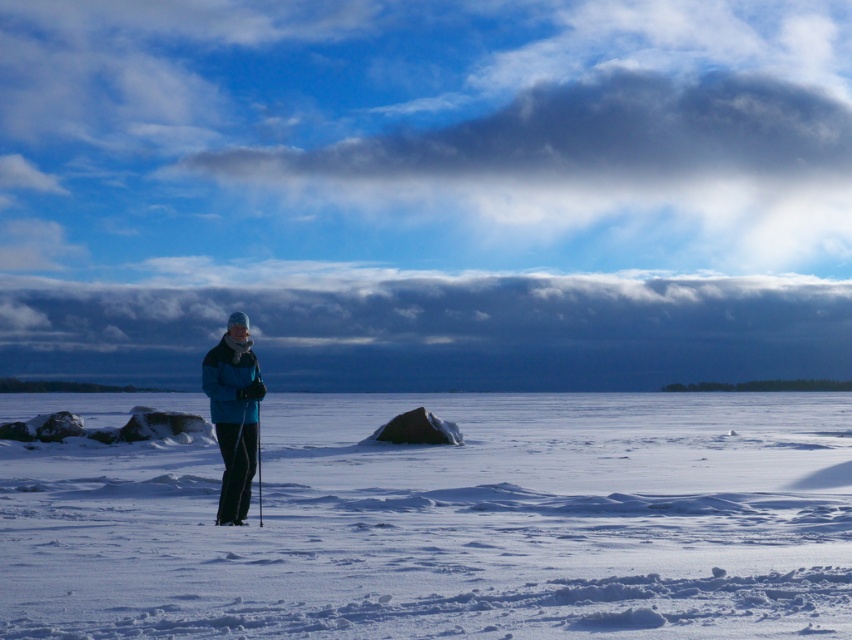
Question: Does white powdery snow at center have a smaller size compared to blue fleece jacket at center?

Choices:
 (A) yes
 (B) no

Answer: (B)

Question: Can you confirm if white powdery snow at center is positioned to the left of blue fleece jacket at center?

Choices:
 (A) no
 (B) yes

Answer: (A)

Question: Does white powdery snow at center appear under blue fleece jacket at center?

Choices:
 (A) no
 (B) yes

Answer: (B)

Question: Which of the following is the closest to the observer?

Choices:
 (A) blue fleece jacket at center
 (B) white powdery snow at center

Answer: (B)